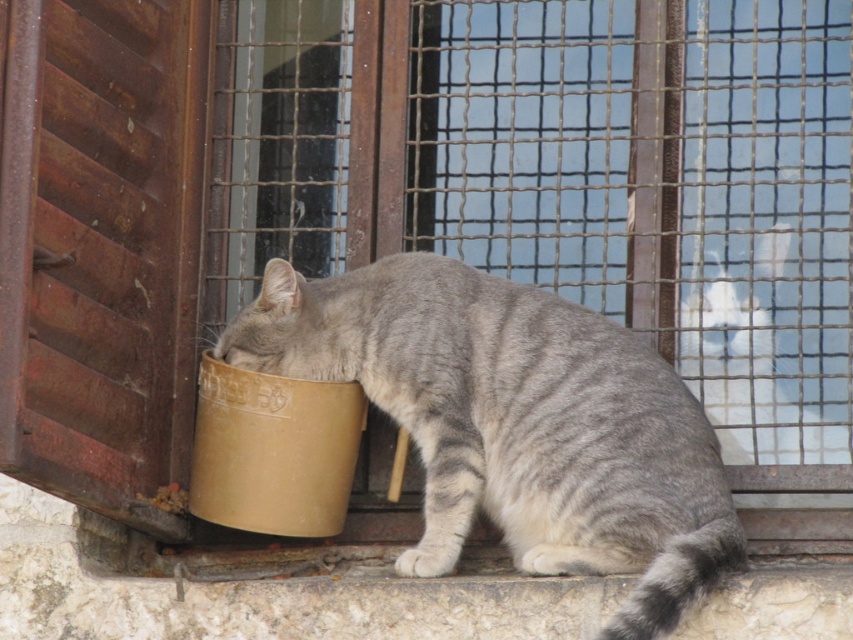
Question: Which object is farther from the camera taking this photo?

Choices:
 (A) white fur cat at upper right
 (B) gray striped fur at center

Answer: (A)

Question: Among these objects, which one is nearest to the camera?

Choices:
 (A) white fur cat at upper right
 (B) gray striped fur at center

Answer: (B)

Question: Is gray striped fur at center bigger than white fur cat at upper right?

Choices:
 (A) yes
 (B) no

Answer: (A)

Question: Does gray striped fur at center lie behind white fur cat at upper right?

Choices:
 (A) yes
 (B) no

Answer: (B)

Question: Which object appears farthest from the camera in this image?

Choices:
 (A) white fur cat at upper right
 (B) gray striped fur at center

Answer: (A)

Question: From the image, what is the correct spatial relationship of gray striped fur at center in relation to white fur cat at upper right?

Choices:
 (A) left
 (B) right

Answer: (A)